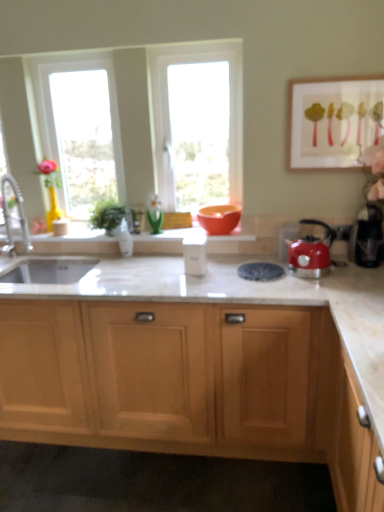
In order to click on vacant area that is in front of red glossy kettle at right in this screenshot , I will do `click(317, 289)`.